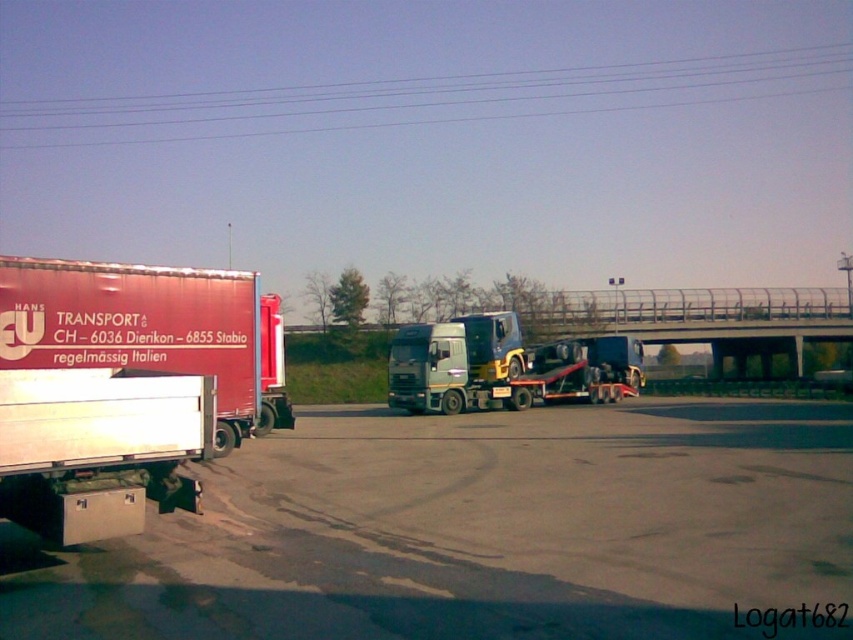
Question: Which object is the farthest from the gray asphalt tarmac at lower center?

Choices:
 (A) metallic silver truck at center
 (B) metallic wires at upper center

Answer: (B)

Question: Which of the following is the closest to the observer?

Choices:
 (A) matte red trailer at left
 (B) metallic silver truck at center
 (C) metallic wires at upper center

Answer: (A)

Question: Is matte red trailer at left smaller than metallic silver truck at center?

Choices:
 (A) yes
 (B) no

Answer: (A)

Question: Which object is positioned farthest from the metallic silver truck at center?

Choices:
 (A) gray asphalt tarmac at lower center
 (B) matte red trailer at left

Answer: (B)

Question: Can you confirm if matte red trailer at left is bigger than metallic silver truck at center?

Choices:
 (A) yes
 (B) no

Answer: (B)

Question: From the image, what is the correct spatial relationship of gray asphalt tarmac at lower center in relation to metallic wires at upper center?

Choices:
 (A) left
 (B) right

Answer: (B)